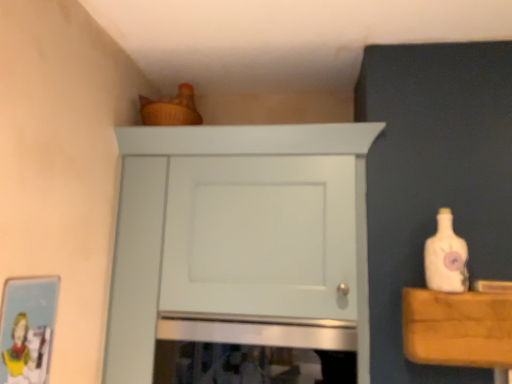
Question: Can we say white matte cabinet at upper center lies outside matte cardboard picture frame at lower left?

Choices:
 (A) yes
 (B) no

Answer: (A)

Question: Is the surface of white matte cabinet at upper center in direct contact with matte cardboard picture frame at lower left?

Choices:
 (A) no
 (B) yes

Answer: (A)

Question: From the image's perspective, is white matte cabinet at upper center located beneath matte cardboard picture frame at lower left?

Choices:
 (A) yes
 (B) no

Answer: (B)

Question: Can you confirm if white matte cabinet at upper center is wider than matte cardboard picture frame at lower left?

Choices:
 (A) no
 (B) yes

Answer: (B)

Question: From the image's perspective, does white matte cabinet at upper center appear higher than matte cardboard picture frame at lower left?

Choices:
 (A) no
 (B) yes

Answer: (B)

Question: Considering the positions of point (467, 283) and point (15, 279), is point (467, 283) closer or farther from the camera than point (15, 279)?

Choices:
 (A) farther
 (B) closer

Answer: (A)

Question: Based on their sizes in the image, would you say white matte bottle at right is bigger or smaller than matte cardboard picture frame at lower left?

Choices:
 (A) small
 (B) big

Answer: (B)

Question: From a real-world perspective, is white matte bottle at right physically located above or below matte cardboard picture frame at lower left?

Choices:
 (A) below
 (B) above

Answer: (B)

Question: Considering the positions of white matte bottle at right and matte cardboard picture frame at lower left in the image, is white matte bottle at right wider or thinner than matte cardboard picture frame at lower left?

Choices:
 (A) thin
 (B) wide

Answer: (B)

Question: Considering the positions of white matte cabinet at upper center and matte cardboard picture frame at lower left in the image, is white matte cabinet at upper center taller or shorter than matte cardboard picture frame at lower left?

Choices:
 (A) short
 (B) tall

Answer: (B)

Question: Is white matte cabinet at upper center in front of or behind matte cardboard picture frame at lower left in the image?

Choices:
 (A) front
 (B) behind

Answer: (B)

Question: From a real-world perspective, relative to matte cardboard picture frame at lower left, is white matte cabinet at upper center vertically above or below?

Choices:
 (A) below
 (B) above

Answer: (B)

Question: Considering the positions of white matte cabinet at upper center and matte cardboard picture frame at lower left in the image, is white matte cabinet at upper center wider or thinner than matte cardboard picture frame at lower left?

Choices:
 (A) wide
 (B) thin

Answer: (A)

Question: Is white matte bottle at right taller or shorter than white matte cabinet at upper center?

Choices:
 (A) tall
 (B) short

Answer: (B)

Question: Is white matte bottle at right wider or thinner than white matte cabinet at upper center?

Choices:
 (A) thin
 (B) wide

Answer: (A)